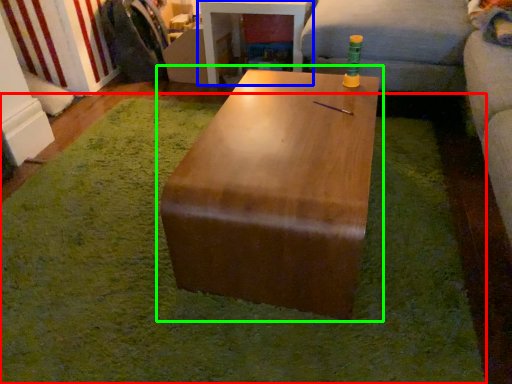
Question: Estimate the real-world distances between objects in this image. Which object is closer to mat (highlighted by a red box), table (highlighted by a blue box) or table (highlighted by a green box)?

Choices:
 (A) table
 (B) table

Answer: (B)